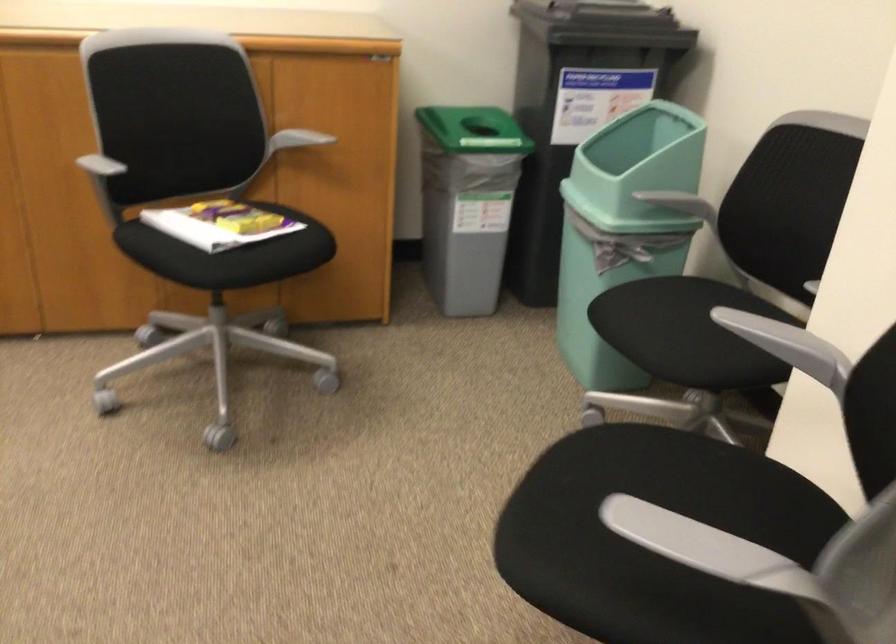
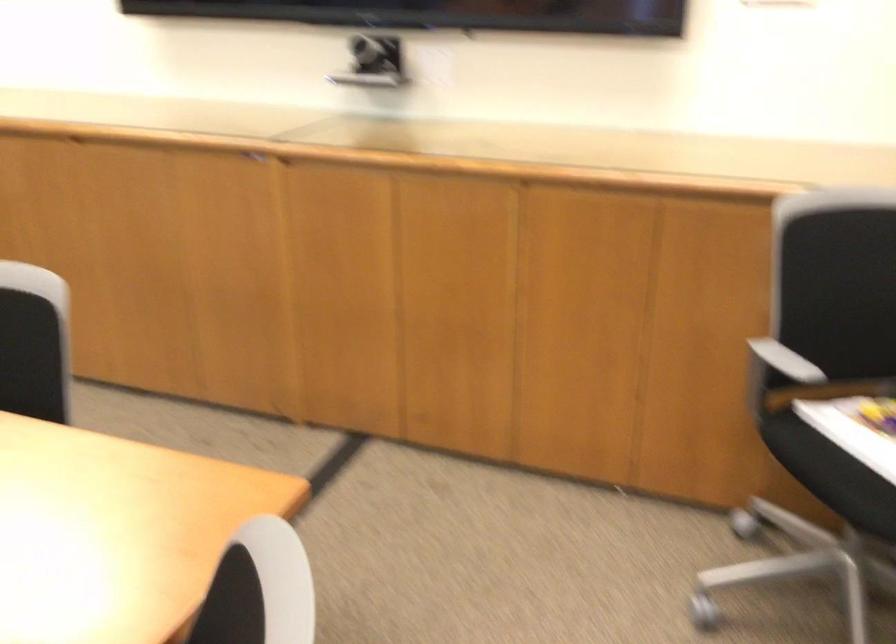
Question: The images are taken continuously from a first-person perspective. In which direction is your viewpoint rotating?

Choices:
 (A) Left
 (B) Right
 (C) Up
 (D) Down

Answer: (A)